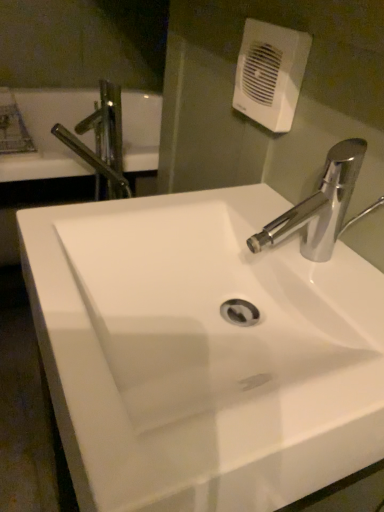
Find the location of a particular element. Image resolution: width=384 pixels, height=512 pixels. white glossy sink at center is located at coordinates (202, 353).

The image size is (384, 512). What do you see at coordinates (202, 353) in the screenshot?
I see `white glossy sink at center` at bounding box center [202, 353].

Where is `white glossy sink at center`? white glossy sink at center is located at coordinates (202, 353).

Is white plastic hand dryer at upper center far away from metallic chrome tap at upper left?

No, white plastic hand dryer at upper center is not far away from metallic chrome tap at upper left.

Is white plastic hand dryer at upper center facing away from metallic chrome tap at upper left?

No, metallic chrome tap at upper left is not at the back of white plastic hand dryer at upper center.

Which is more to the left, white plastic hand dryer at upper center or metallic chrome tap at upper left?

Positioned to the left is metallic chrome tap at upper left.

Which object is wider, white plastic hand dryer at upper center or metallic chrome tap at upper left?

metallic chrome tap at upper left.

Between white plastic hand dryer at upper center and white glossy sink at center, which one has smaller size?

white plastic hand dryer at upper center is smaller.

Find the location of a particular element. Image resolution: width=384 pixels, height=512 pixels. sink located in front of the white plastic hand dryer at upper center is located at coordinates (202, 353).

From the picture: Can we say white plastic hand dryer at upper center lies outside white glossy sink at center?

white plastic hand dryer at upper center lies outside white glossy sink at center's area.

Considering the positions of objects white plastic hand dryer at upper center and white glossy sink at center in the image provided, who is behind, white plastic hand dryer at upper center or white glossy sink at center?

white plastic hand dryer at upper center is more distant.

Is white glossy sink at center outside of metallic chrome tap at upper left?

Yes, white glossy sink at center is located beyond the bounds of metallic chrome tap at upper left.

Which object is further away from the camera taking this photo, white glossy sink at center or metallic chrome tap at upper left?

metallic chrome tap at upper left is more distant.

Is white glossy sink at center thinner than metallic chrome tap at upper left?

Incorrect, the width of white glossy sink at center is not less than that of metallic chrome tap at upper left.

Looking at the image, does white glossy sink at center seem bigger or smaller compared to metallic chrome tap at upper left?

Clearly, white glossy sink at center is larger in size than metallic chrome tap at upper left.

Locate an element on the screen. Image resolution: width=384 pixels, height=512 pixels. tap that appears below the white glossy sink at center (from a real-world perspective) is located at coordinates (102, 142).

From a real-world perspective, who is located lower, metallic chrome tap at upper left or white glossy sink at center?

metallic chrome tap at upper left is physically lower.

Between metallic chrome tap at upper left and white glossy sink at center, which one is positioned in front?

white glossy sink at center is closer to the camera.

Can you confirm if white glossy sink at center is taller than white plastic hand dryer at upper center?

Yes.

Considering the sizes of objects white glossy sink at center and white plastic hand dryer at upper center in the image provided, who is bigger, white glossy sink at center or white plastic hand dryer at upper center?

With larger size is white glossy sink at center.

Consider the image. Considering the positions of objects white glossy sink at center and white plastic hand dryer at upper center in the image provided, who is in front, white glossy sink at center or white plastic hand dryer at upper center?

Positioned in front is white glossy sink at center.

Would you say white glossy sink at center is to the left or to the right of white plastic hand dryer at upper center in the picture?

From the image, it's evident that white glossy sink at center is to the left of white plastic hand dryer at upper center.

Is metallic chrome tap at upper left placed right next to white plastic hand dryer at upper center?

metallic chrome tap at upper left is not next to white plastic hand dryer at upper center, and they're not touching.

In the image, is metallic chrome tap at upper left positioned in front of or behind white plastic hand dryer at upper center?

Clearly, metallic chrome tap at upper left is behind white plastic hand dryer at upper center.

Which is less distant, (112, 114) or (307, 48)?

Positioned in front is point (307, 48).

This screenshot has width=384, height=512. I want to click on tap lying above the white plastic hand dryer at upper center (from the image's perspective), so click(102, 142).

At what (x,y) coordinates should I click in order to perform the action: click on tap below the white plastic hand dryer at upper center (from a real-world perspective). Please return your answer as a coordinate pair (x, y). The width and height of the screenshot is (384, 512). Looking at the image, I should click on (102, 142).

Where is `sink on the left of white plastic hand dryer at upper center`? sink on the left of white plastic hand dryer at upper center is located at coordinates (202, 353).

Looking at the image, which one is located closer to white plastic hand dryer at upper center, metallic chrome tap at upper left or white glossy sink at center?

white glossy sink at center is closer to white plastic hand dryer at upper center.

From the image, which object appears to be nearer to metallic chrome tap at upper left, white glossy sink at center or white plastic hand dryer at upper center?

The object closer to metallic chrome tap at upper left is white plastic hand dryer at upper center.

From the image, which object appears to be farther from white glossy sink at center, white plastic hand dryer at upper center or metallic chrome tap at upper left?

Among the two, metallic chrome tap at upper left is located further to white glossy sink at center.

Consider the image. Looking at the image, which one is located further to white glossy sink at center, metallic chrome tap at upper left or white plastic hand dryer at upper center?

Based on the image, metallic chrome tap at upper left appears to be further to white glossy sink at center.

From the image, which object appears to be farther from white plastic hand dryer at upper center, white glossy sink at center or metallic chrome tap at upper left?

metallic chrome tap at upper left lies further to white plastic hand dryer at upper center than the other object.

Looking at the image, which one is located closer to metallic chrome tap at upper left, white plastic hand dryer at upper center or white glossy sink at center?

white plastic hand dryer at upper center is closer to metallic chrome tap at upper left.

At what (x,y) coordinates should I click in order to perform the action: click on hand dryer between white glossy sink at center and metallic chrome tap at upper left in the front-back direction. Please return your answer as a coordinate pair (x, y). Image resolution: width=384 pixels, height=512 pixels. Looking at the image, I should click on (270, 74).